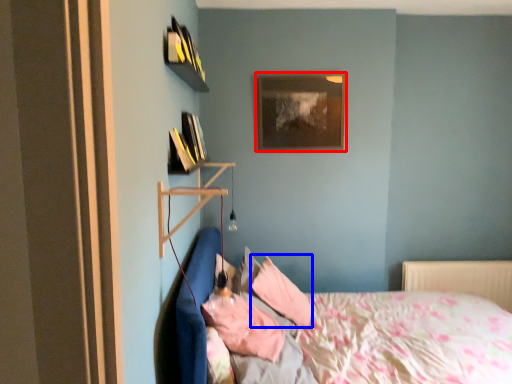
Question: Which object is closer to the camera taking this photo, picture frame (highlighted by a red box) or pillow (highlighted by a blue box)?

Choices:
 (A) picture frame
 (B) pillow

Answer: (B)